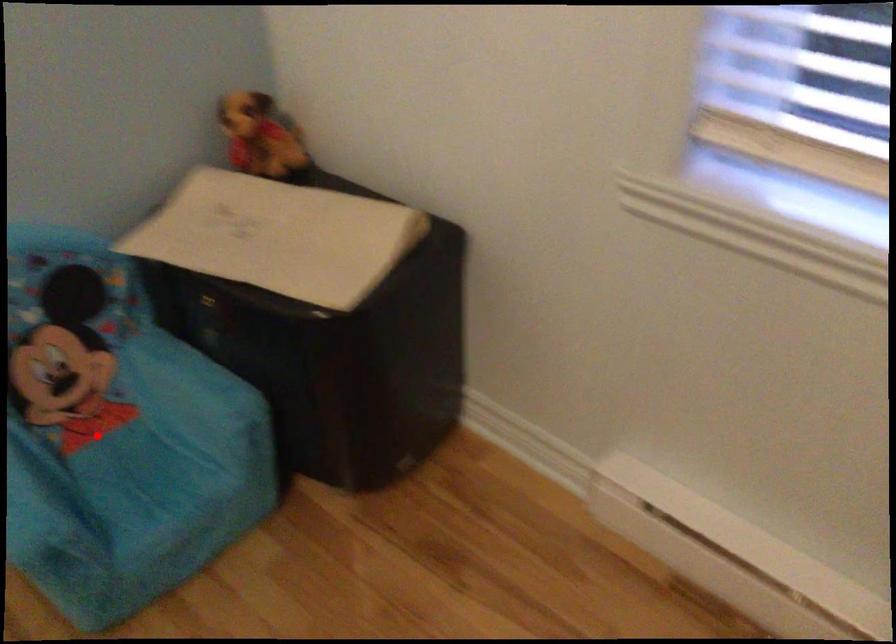
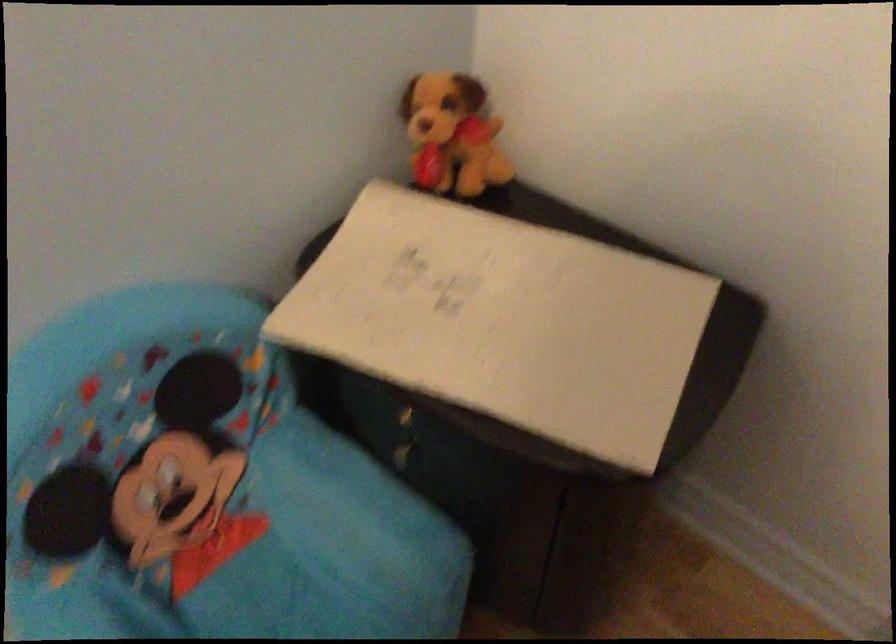
The point at the highlighted location is marked in the first image. Where is the corresponding point in the second image?

(220, 554)